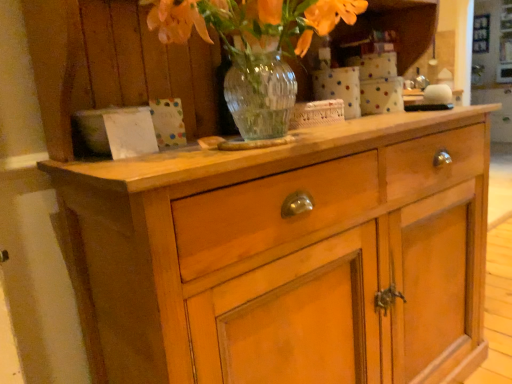
Question: Considering their positions, is translucent glass vase at upper center located in front of or behind wooden cabinet at center?

Choices:
 (A) behind
 (B) front

Answer: (A)

Question: In terms of width, does translucent glass vase at upper center look wider or thinner when compared to wooden cabinet at center?

Choices:
 (A) wide
 (B) thin

Answer: (B)

Question: From the image's perspective, relative to wooden cabinet at center, is translucent glass vase at upper center above or below?

Choices:
 (A) below
 (B) above

Answer: (B)

Question: Considering the positions of wooden cabinet at center and translucent glass vase at upper center in the image, is wooden cabinet at center taller or shorter than translucent glass vase at upper center?

Choices:
 (A) tall
 (B) short

Answer: (A)

Question: Is wooden cabinet at center to the left or to the right of translucent glass vase at upper center in the image?

Choices:
 (A) right
 (B) left

Answer: (A)

Question: From a real-world perspective, is wooden cabinet at center positioned above or below translucent glass vase at upper center?

Choices:
 (A) below
 (B) above

Answer: (A)

Question: Is point (301, 271) closer or farther from the camera than point (267, 54)?

Choices:
 (A) closer
 (B) farther

Answer: (B)